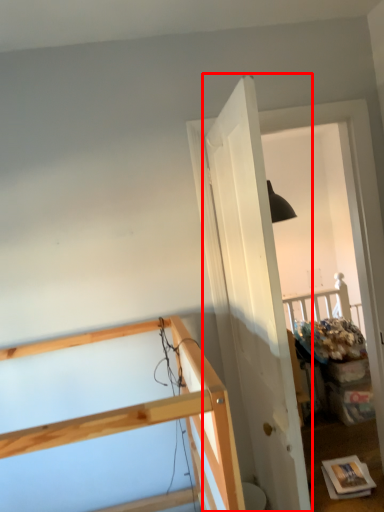
Question: From the image's perspective, where is door (annotated by the red box) located in relation to furniture in the image?

Choices:
 (A) above
 (B) below

Answer: (A)